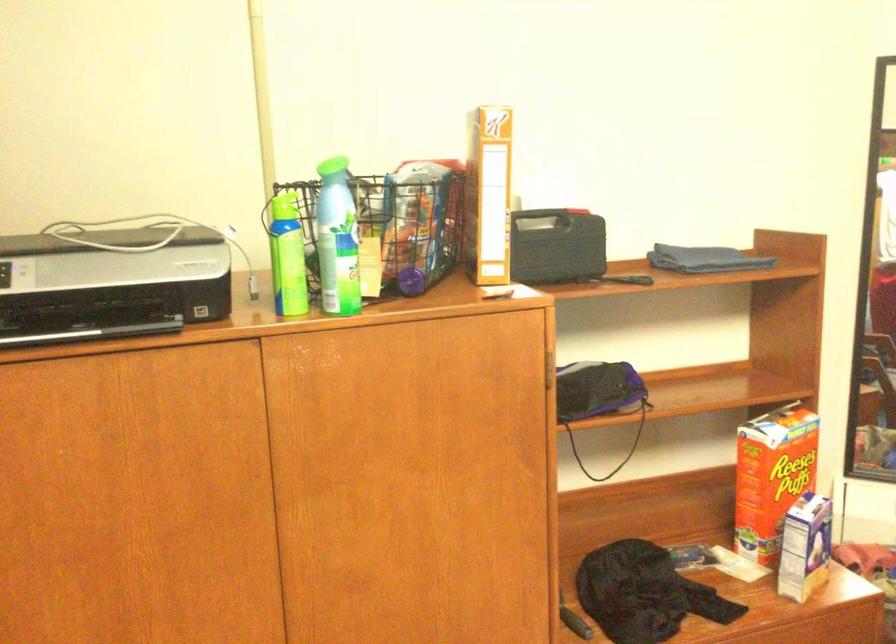
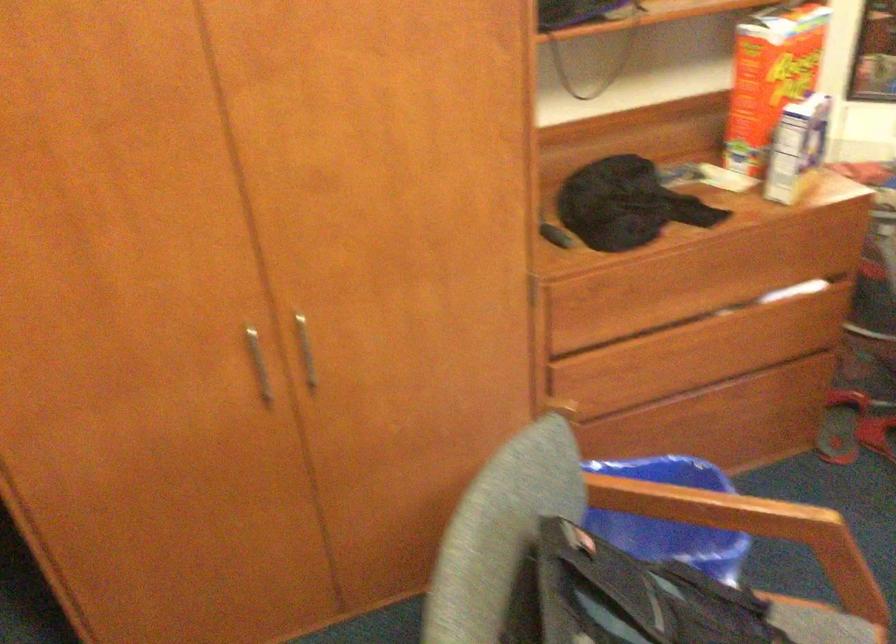
The images are taken continuously from a first-person perspective. In which direction are you moving?

The cameraman moved toward right, forward.